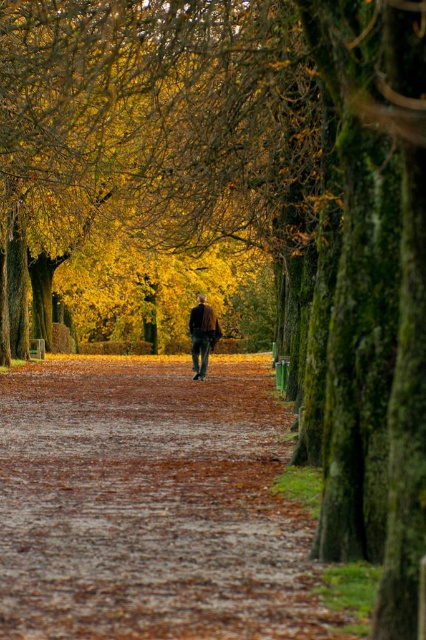
Question: Which of the following is the farthest from the observer?

Choices:
 (A) tap(199, 333)
 (B) tap(51, 451)

Answer: (A)

Question: Which point appears farthest from the camera in this image?

Choices:
 (A) (97, 637)
 (B) (198, 323)

Answer: (B)

Question: Among these objects, which one is farthest from the camera?

Choices:
 (A) dark brown leather jacket at center
 (B) brown leafy path at center

Answer: (A)

Question: Does brown leafy path at center have a greater width compared to dark brown leather jacket at center?

Choices:
 (A) no
 (B) yes

Answer: (B)

Question: Does brown leafy path at center come in front of dark brown leather jacket at center?

Choices:
 (A) yes
 (B) no

Answer: (A)

Question: Does brown leafy path at center have a smaller size compared to dark brown leather jacket at center?

Choices:
 (A) no
 (B) yes

Answer: (A)